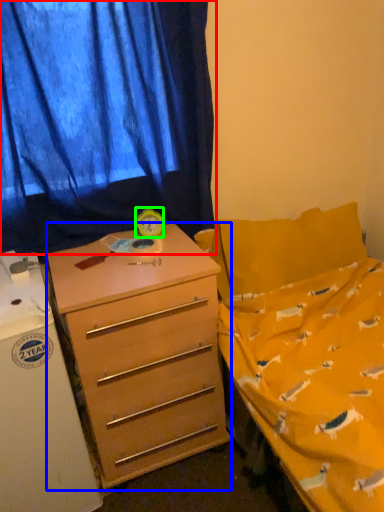
Question: Based on their relative distances, which object is farther from curtain (highlighted by a red box)? Choose from desk (highlighted by a blue box) and clock (highlighted by a green box).

Choices:
 (A) desk
 (B) clock

Answer: (A)